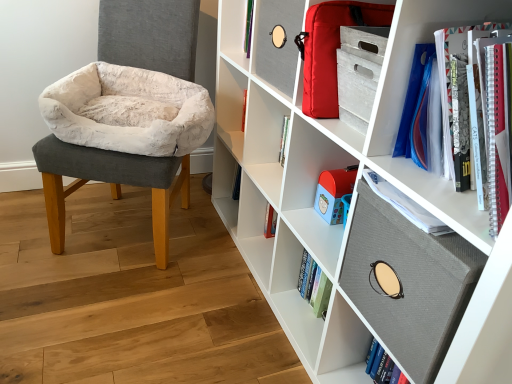
This screenshot has height=384, width=512. What do you see at coordinates (124, 138) in the screenshot?
I see `white plush cushion at left` at bounding box center [124, 138].

Image resolution: width=512 pixels, height=384 pixels. In order to click on textured gray board at upper right, which ranks as the 2th cabinet in top-to-bottom order in this screenshot , I will do `click(409, 283)`.

What do you see at coordinates (409, 283) in the screenshot? I see `textured gray board at upper right, which ranks as the 2th cabinet in top-to-bottom order` at bounding box center [409, 283].

Find the location of `white plush cushion at left`. white plush cushion at left is located at coordinates (124, 138).

How many degrees apart are the facing directions of spiral-bound notebooks at upper right, acting as the second shelf starting from the bottom, and white plush cushion at left?

The angle between the facing direction of spiral-bound notebooks at upper right, acting as the second shelf starting from the bottom, and the facing direction of white plush cushion at left is 57.6 degrees.

Considering the positions of objects spiral-bound notebooks at upper right, acting as the second shelf starting from the bottom, and white plush cushion at left in the image provided, who is more to the left, spiral-bound notebooks at upper right, acting as the second shelf starting from the bottom, or white plush cushion at left?

white plush cushion at left.

From the image's perspective, which one is positioned lower, spiral-bound notebooks at upper right, acting as the second shelf starting from the bottom, or white plush cushion at left?

spiral-bound notebooks at upper right, acting as the second shelf starting from the bottom, is shown below in the image.

Which object is wider, spiral-bound notebooks at upper right, acting as the second shelf starting from the bottom, or white plush cushion at left?

white plush cushion at left.

Is textured gray board at upper right, which ranks as the 2th cabinet in top-to-bottom order, surrounded by white plush cushion at left?

No, white plush cushion at left does not contain textured gray board at upper right, which ranks as the 2th cabinet in top-to-bottom order.

Is point (208, 100) positioned before point (441, 326)?

No, (208, 100) is behind (441, 326).

In the scene shown: Are white plush cushion at left and textured gray board at upper right, which ranks as the 2th cabinet in top-to-bottom order, beside each other?

There is a gap between white plush cushion at left and textured gray board at upper right, which ranks as the 2th cabinet in top-to-bottom order.

Measure the distance from white plush cushion at left to textured gray board at upper right, which is counted as the first cabinet, starting from the bottom.

white plush cushion at left is 36.84 inches away from textured gray board at upper right, which is counted as the first cabinet, starting from the bottom.

From a real-world perspective, relative to textured gray board at upper right, which is counted as the first cabinet, starting from the bottom, is matte red bag at upper right, the first cabinet positioned from the top, vertically above or below?

Clearly, from a real-world perspective, matte red bag at upper right, the first cabinet positioned from the top, is above textured gray board at upper right, which is counted as the first cabinet, starting from the bottom.

Can you confirm if matte red bag at upper right, which ranks as the second cabinet in bottom-to-top order, is positioned to the right of textured gray board at upper right, which is counted as the first cabinet, starting from the bottom?

Incorrect, matte red bag at upper right, which ranks as the second cabinet in bottom-to-top order, is not on the right side of textured gray board at upper right, which is counted as the first cabinet, starting from the bottom.

Which of these two, matte red bag at upper right, which ranks as the second cabinet in bottom-to-top order, or textured gray board at upper right, which is counted as the first cabinet, starting from the bottom, is wider?

textured gray board at upper right, which is counted as the first cabinet, starting from the bottom, is wider.

Can you confirm if matte red bag at upper right, the first cabinet positioned from the top, is bigger than textured gray board at upper right, which is counted as the first cabinet, starting from the bottom?

No.

Measure the distance between white matte bookshelf at center, which is counted as the 3th shelf, starting from the bottom, and spiral-bound notebooks at upper right, acting as the second shelf starting from the bottom.

The distance of white matte bookshelf at center, which is counted as the 3th shelf, starting from the bottom, from spiral-bound notebooks at upper right, acting as the second shelf starting from the bottom, is 27.32 inches.

From a real-world perspective, who is located lower, white matte bookshelf at center, which is counted as the 3th shelf, starting from the bottom, or spiral-bound notebooks at upper right, which is counted as the second shelf, starting from the top?

In real-world perspective, white matte bookshelf at center, which is counted as the 3th shelf, starting from the bottom, is lower.

From the spiral-bound notebooks at upper right, acting as the second shelf starting from the bottom, count the 2nd shelf to the left and point to it. Please provide its 2D coordinates.

[(264, 140)]

Does point (270, 152) come closer to viewer compared to point (393, 101)?

No.

From the image's perspective, is white fabric bookshelf at upper right, which is the third shelf in top-to-bottom order, over white matte bookshelf at center, the 1th shelf when ordered from top to bottom?

No, from the image's perspective, white fabric bookshelf at upper right, which is the third shelf in top-to-bottom order, is not on top of white matte bookshelf at center, the 1th shelf when ordered from top to bottom.

Where is `shelf that appears on the left of white fabric bookshelf at upper right, which is the third shelf in top-to-bottom order`? Image resolution: width=512 pixels, height=384 pixels. shelf that appears on the left of white fabric bookshelf at upper right, which is the third shelf in top-to-bottom order is located at coordinates (264, 140).

What's the angular difference between white fabric bookshelf at upper right, arranged as the 1th shelf when ordered from the bottom, and white matte bookshelf at center, which is counted as the 3th shelf, starting from the bottom,'s facing directions?

The angle between the facing direction of white fabric bookshelf at upper right, arranged as the 1th shelf when ordered from the bottom, and the facing direction of white matte bookshelf at center, which is counted as the 3th shelf, starting from the bottom, is 0.419 degrees.

Does white fabric bookshelf at upper right, which is the third shelf in top-to-bottom order, have a lesser width compared to white matte bookshelf at center, which is counted as the 3th shelf, starting from the bottom?

Incorrect, the width of white fabric bookshelf at upper right, which is the third shelf in top-to-bottom order, is not less than that of white matte bookshelf at center, which is counted as the 3th shelf, starting from the bottom.

Between white matte bookshelf at center, which is counted as the 3th shelf, starting from the bottom, and white plush cushion at left, which one has smaller size?

white matte bookshelf at center, which is counted as the 3th shelf, starting from the bottom.

Can you confirm if white matte bookshelf at center, the 1th shelf when ordered from top to bottom, is positioned to the right of white plush cushion at left?

Yes.

Can you confirm if white matte bookshelf at center, the 1th shelf when ordered from top to bottom, is shorter than white plush cushion at left?

Correct, white matte bookshelf at center, the 1th shelf when ordered from top to bottom, is not as tall as white plush cushion at left.

From a real-world perspective, which is physically below, white matte bookshelf at center, the 1th shelf when ordered from top to bottom, or white plush cushion at left?

white matte bookshelf at center, the 1th shelf when ordered from top to bottom.

From the image's perspective, is matte red bag at upper right, the first cabinet positioned from the top, on white plush cushion at left?

Yes, from the image's perspective, matte red bag at upper right, the first cabinet positioned from the top, is on top of white plush cushion at left.

Is matte red bag at upper right, the first cabinet positioned from the top, outside of white plush cushion at left?

Yes, matte red bag at upper right, the first cabinet positioned from the top, is located beyond the bounds of white plush cushion at left.

From a real-world perspective, is matte red bag at upper right, the first cabinet positioned from the top, located higher than white plush cushion at left?

Yes, from a real-world perspective, matte red bag at upper right, the first cabinet positioned from the top, is on top of white plush cushion at left.

Considering the relative positions of matte red bag at upper right, which ranks as the second cabinet in bottom-to-top order, and white plush cushion at left in the image provided, is matte red bag at upper right, which ranks as the second cabinet in bottom-to-top order, behind white plush cushion at left?

No, it is in front of white plush cushion at left.

Locate an element on the screen. The image size is (512, 384). chair that appears behind the spiral-bound notebooks at upper right, acting as the second shelf starting from the bottom is located at coordinates (124, 138).

Identify the location of the 2nd cabinet counting from the right of the white plush cushion at left. (409, 283).

When comparing their distances from white matte bookshelf at center, which is counted as the 3th shelf, starting from the bottom, does matte red bag at upper right, the first cabinet positioned from the top, or textured gray board at upper right, which is counted as the first cabinet, starting from the bottom, seem closer?

matte red bag at upper right, the first cabinet positioned from the top, lies closer to white matte bookshelf at center, which is counted as the 3th shelf, starting from the bottom, than the other object.

Considering their positions, is matte red bag at upper right, which ranks as the second cabinet in bottom-to-top order, positioned closer to white matte bookshelf at center, which is counted as the 3th shelf, starting from the bottom, than white fabric bookshelf at upper right, arranged as the 1th shelf when ordered from the bottom?

Based on the image, white fabric bookshelf at upper right, arranged as the 1th shelf when ordered from the bottom, appears to be nearer to white matte bookshelf at center, which is counted as the 3th shelf, starting from the bottom.

Which object lies nearer to the anchor point matte red bag at upper right, which ranks as the second cabinet in bottom-to-top order, white plush cushion at left or white fabric bookshelf at upper right, arranged as the 1th shelf when ordered from the bottom?

The object closer to matte red bag at upper right, which ranks as the second cabinet in bottom-to-top order, is white fabric bookshelf at upper right, arranged as the 1th shelf when ordered from the bottom.

Based on the photo, looking at the image, which one is located closer to spiral-bound notebooks at upper right, which is counted as the second shelf, starting from the top, matte red bag at upper right, the first cabinet positioned from the top, or white matte bookshelf at center, which is counted as the 3th shelf, starting from the bottom?

The object closer to spiral-bound notebooks at upper right, which is counted as the second shelf, starting from the top, is matte red bag at upper right, the first cabinet positioned from the top.

Estimate the real-world distances between objects in this image. Which object is further from textured gray board at upper right, which ranks as the 2th cabinet in top-to-bottom order, white fabric bookshelf at upper right, arranged as the 1th shelf when ordered from the bottom, or spiral-bound notebooks at upper right, acting as the second shelf starting from the bottom?

Among the two, white fabric bookshelf at upper right, arranged as the 1th shelf when ordered from the bottom, is located further to textured gray board at upper right, which ranks as the 2th cabinet in top-to-bottom order.

Estimate the real-world distances between objects in this image. Which object is further from white fabric bookshelf at upper right, which is the third shelf in top-to-bottom order, spiral-bound notebooks at upper right, acting as the second shelf starting from the bottom, or white matte bookshelf at center, the 1th shelf when ordered from top to bottom?

The object further to white fabric bookshelf at upper right, which is the third shelf in top-to-bottom order, is spiral-bound notebooks at upper right, acting as the second shelf starting from the bottom.

From the image, which object appears to be nearer to white matte bookshelf at center, the 1th shelf when ordered from top to bottom, textured gray board at upper right, which ranks as the 2th cabinet in top-to-bottom order, or matte red bag at upper right, the first cabinet positioned from the top?

matte red bag at upper right, the first cabinet positioned from the top, is closer to white matte bookshelf at center, the 1th shelf when ordered from top to bottom.

Consider the image. Which object lies further to the anchor point spiral-bound notebooks at upper right, which is counted as the second shelf, starting from the top, matte red bag at upper right, which ranks as the second cabinet in bottom-to-top order, or white plush cushion at left?

Among the two, white plush cushion at left is located further to spiral-bound notebooks at upper right, which is counted as the second shelf, starting from the top.

The height and width of the screenshot is (384, 512). What are the coordinates of `chair between white fabric bookshelf at upper right, which is the third shelf in top-to-bottom order, and white matte bookshelf at center, which is counted as the 3th shelf, starting from the bottom, in the front-back direction` in the screenshot? It's located at (124, 138).

The width and height of the screenshot is (512, 384). What are the coordinates of `cabinet positioned between white fabric bookshelf at upper right, arranged as the 1th shelf when ordered from the bottom, and matte red bag at upper right, which ranks as the second cabinet in bottom-to-top order, from near to far` in the screenshot? It's located at point(409,283).

In order to click on chair positioned between spiral-bound notebooks at upper right, which is counted as the second shelf, starting from the top, and white matte bookshelf at center, which is counted as the 3th shelf, starting from the bottom, from near to far in this screenshot , I will do `click(124, 138)`.

Image resolution: width=512 pixels, height=384 pixels. What are the coordinates of `shelf positioned between white fabric bookshelf at upper right, which is the third shelf in top-to-bottom order, and white matte bookshelf at center, the 1th shelf when ordered from top to bottom, from near to far` in the screenshot? It's located at click(402, 106).